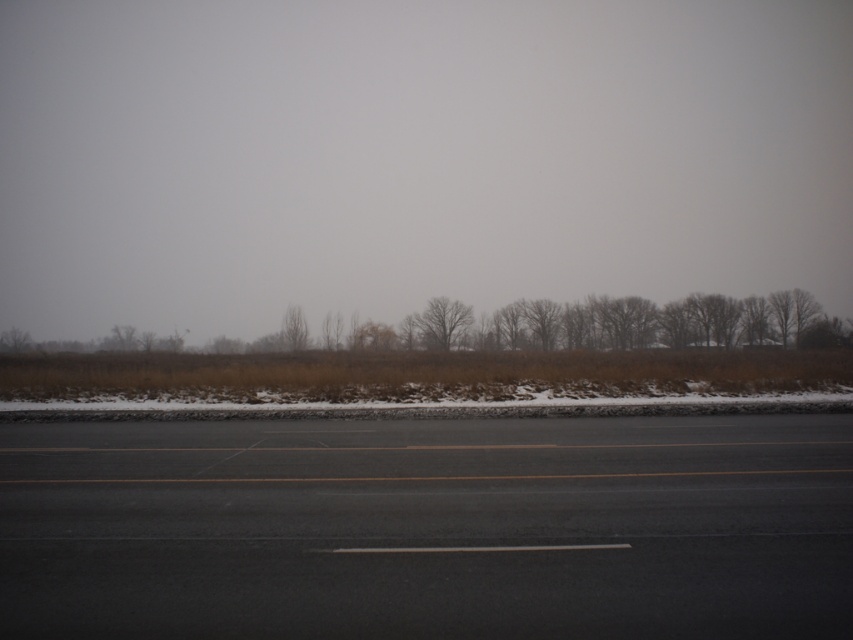
You are a driver approaching the road and see the foggy atmosphere at upper center and the brown matte tree at center. Which object is wider from your perspective?

The foggy atmosphere at upper center might be wider than brown matte tree at center according to the description.

You are driving on the road and want to see the brown matte tree at center clearly. Is the foggy atmosphere at upper center blocking your view of it?

The foggy atmosphere at upper center is taller than brown matte tree at center, so yes, the foggy atmosphere at upper center is blocking your view of the brown matte tree at center.

You are driving a car and see two points on the road ahead. The first point is at position point [685,260] and the second is at point [305,332]. Which point is closer to your current position?

Point [305,332] is closer to your current position because it is in front of point [685,260], which is further back along the road.